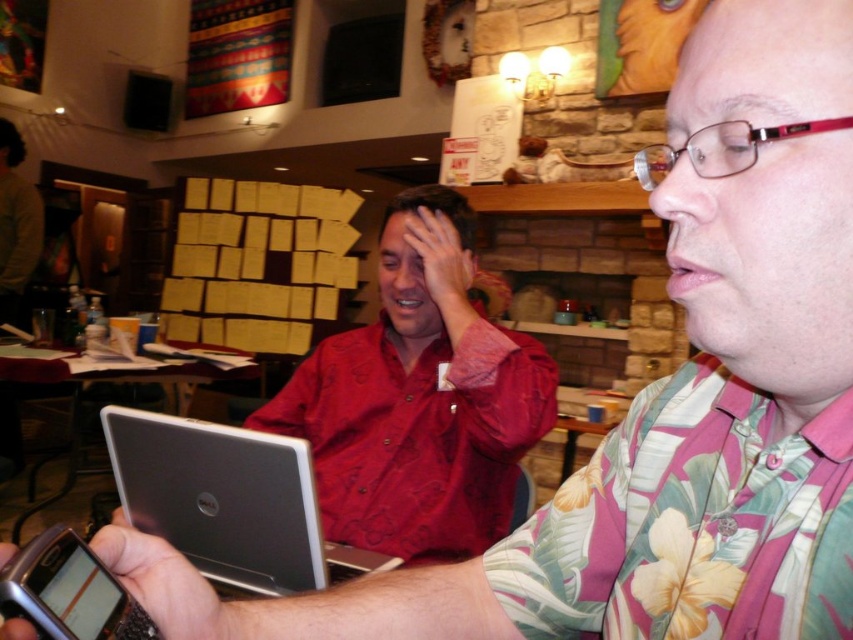
Is point (722, 618) farther from viewer compared to point (383, 545)?

No, (722, 618) is closer to viewer.

Where is `pink floral shirt at right`? pink floral shirt at right is located at coordinates (692, 524).

Does pink floral shirt at right have a larger size compared to silver metallic laptop at center?

Incorrect, pink floral shirt at right is not larger than silver metallic laptop at center.

Can you confirm if pink floral shirt at right is shorter than silver metallic laptop at center?

Indeed, pink floral shirt at right has a lesser height compared to silver metallic laptop at center.

Between point (712, 593) and point (291, 548), which one is positioned in front?

Point (712, 593)

The width and height of the screenshot is (853, 640). In order to click on pink floral shirt at right in this screenshot , I will do `click(692, 524)`.

Between matte red shirt at center and silver metallic laptop at center, which one is positioned higher?

Positioned higher is matte red shirt at center.

Which is in front, point (419, 515) or point (128, 422)?

Point (128, 422) is more forward.

In order to click on matte red shirt at center in this screenshot , I will do `click(419, 400)`.